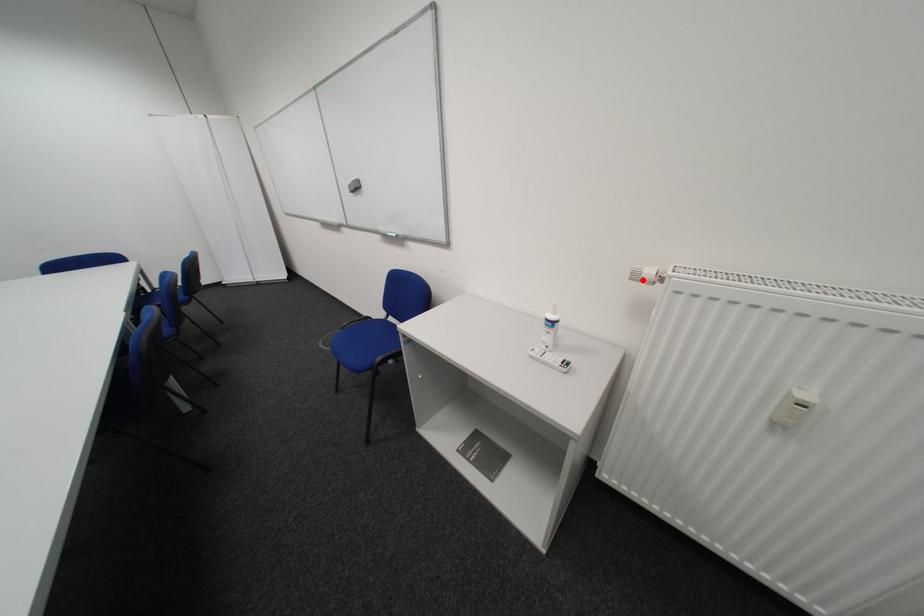
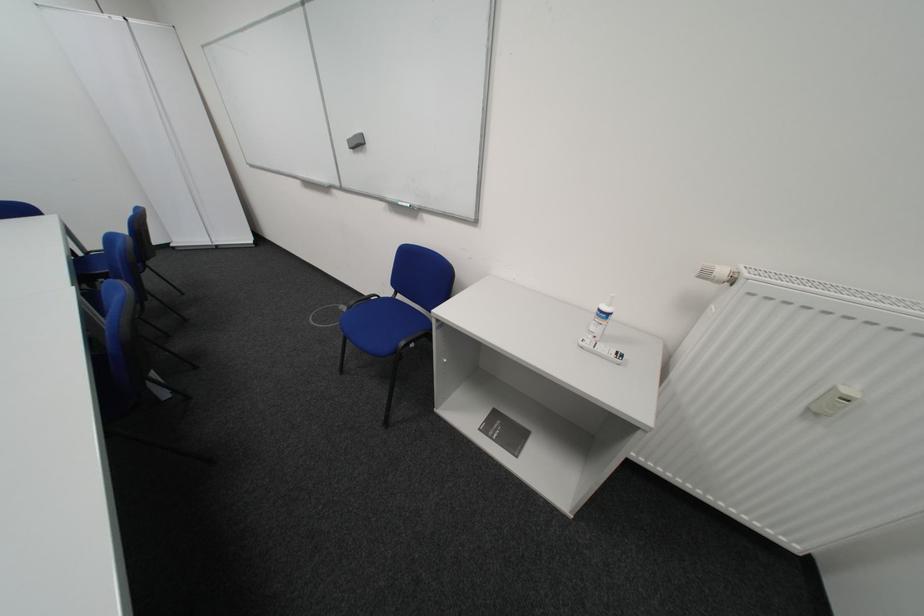
Find the pixel in the second image that matches the highlighted location in the first image.

(710, 278)